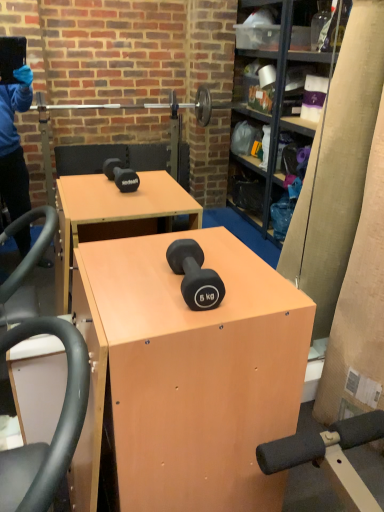
Question: Considering the positions of matte black dumbbell at center and light brown wood desk at center in the image, is matte black dumbbell at center wider or thinner than light brown wood desk at center?

Choices:
 (A) thin
 (B) wide

Answer: (A)

Question: From the image's perspective, is matte black dumbbell at center above or below light brown wood desk at center?

Choices:
 (A) above
 (B) below

Answer: (A)

Question: Looking at the image, does matte black dumbbell at center seem bigger or smaller compared to light brown wood desk at center?

Choices:
 (A) big
 (B) small

Answer: (B)

Question: Is light brown wood desk at center spatially inside matte black dumbbell at center, or outside of it?

Choices:
 (A) inside
 (B) outside

Answer: (B)

Question: From the image's perspective, is light brown wood desk at center positioned above or below matte black dumbbell at center?

Choices:
 (A) below
 (B) above

Answer: (A)

Question: Visually, is light brown wood desk at center positioned to the left or to the right of matte black dumbbell at center?

Choices:
 (A) right
 (B) left

Answer: (B)

Question: Does point (251, 468) appear closer or farther from the camera than point (213, 295)?

Choices:
 (A) closer
 (B) farther

Answer: (B)